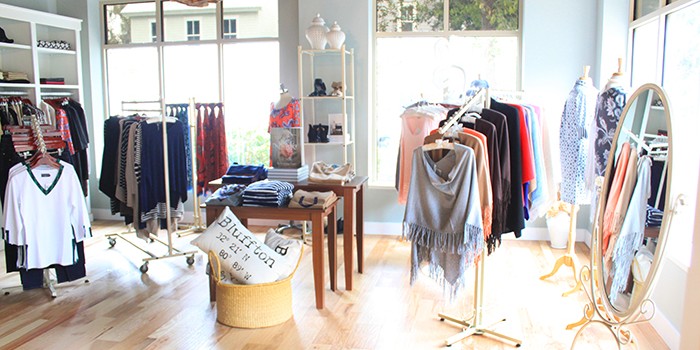
Find the location of `poncho on hanger`. poncho on hanger is located at coordinates (447, 202).